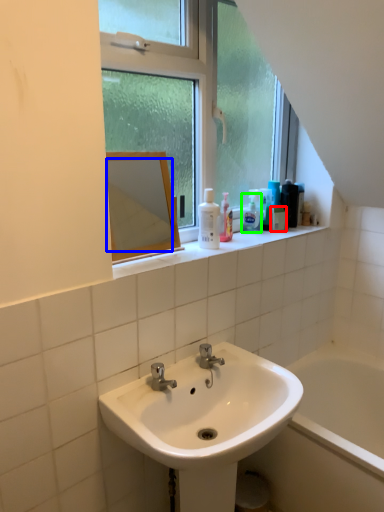
Question: Estimate the real-world distances between objects in this image. Which object is farther from mouthwash (highlighted by a red box), mirror (highlighted by a blue box) or soap dispenser (highlighted by a green box)?

Choices:
 (A) mirror
 (B) soap dispenser

Answer: (A)